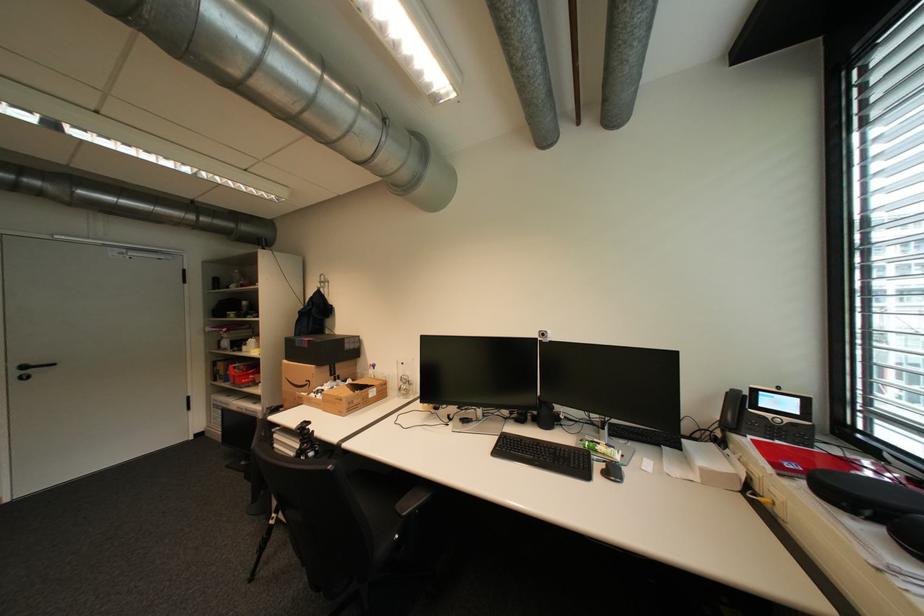
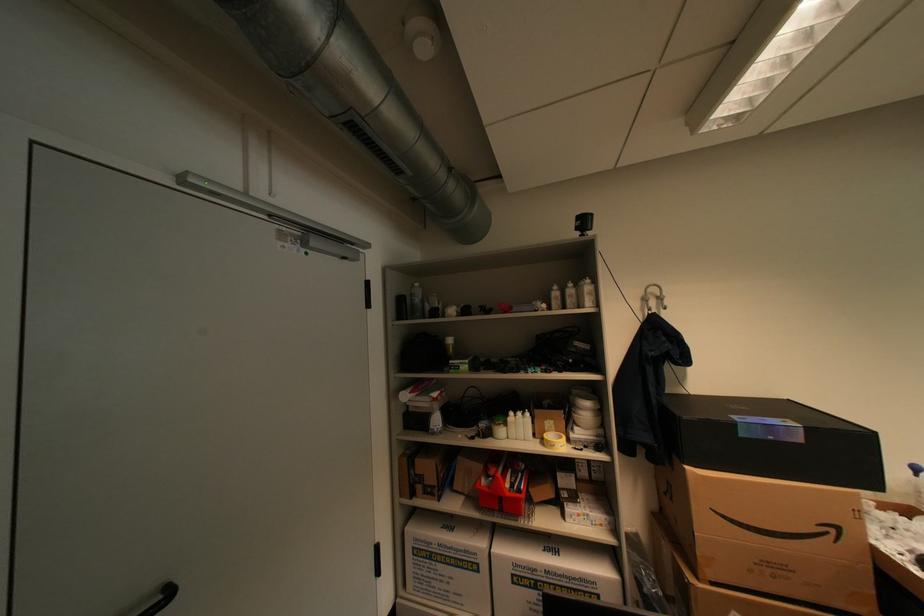
Where in the second image is the point corresponding to (x=62, y=365) from the first image?

(176, 594)